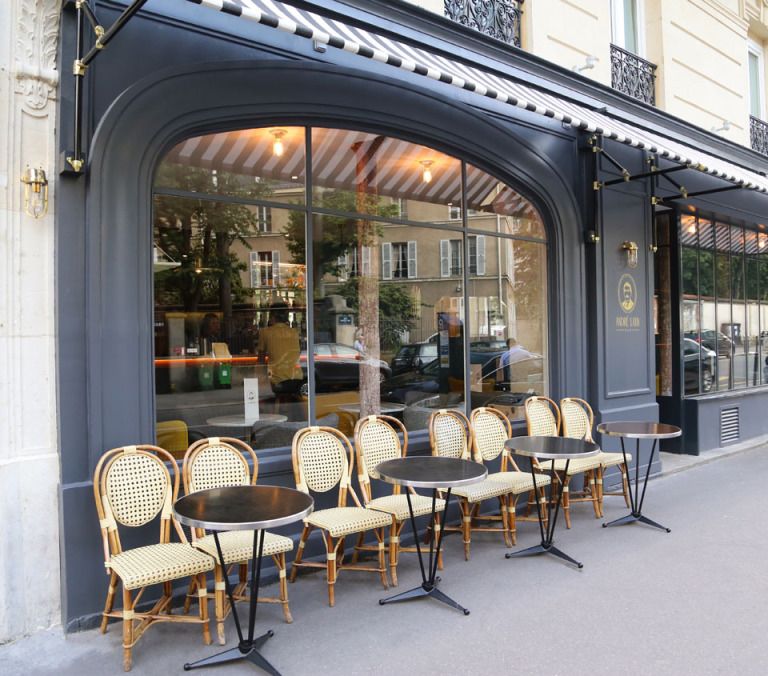
Where is `round tables`? round tables is located at coordinates (299, 512), (438, 476), (564, 460), (657, 437).